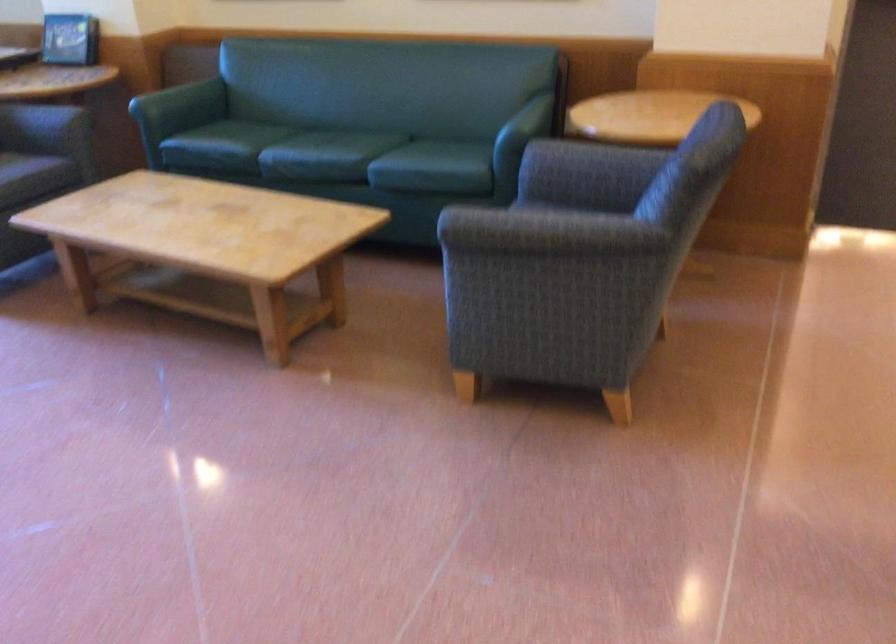
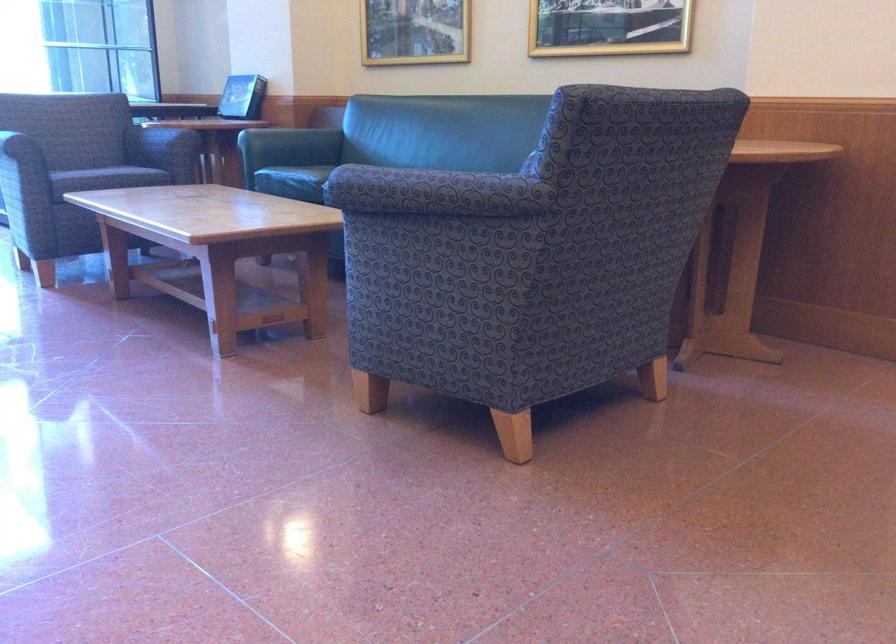
Locate, in the second image, the point that corresponds to (x=547, y=239) in the first image.

(425, 192)